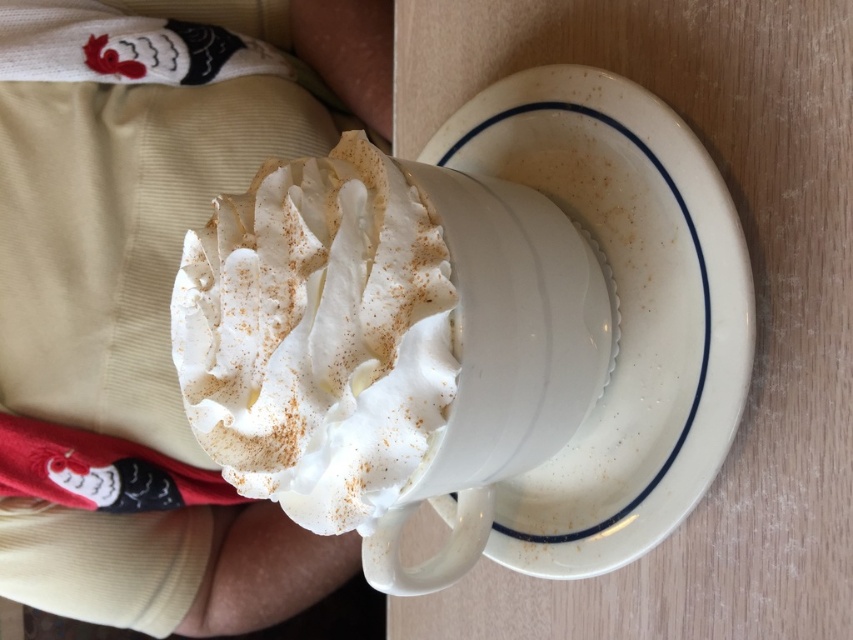
You are trying to place the white ceramic saucer at center on top of the white cotton socks at lower left. Will the saucer fit entirely on the socks without hanging off the edges?

The white cotton socks at lower left are wider than the white ceramic saucer at center, so the saucer will fit entirely on the socks without hanging off the edges.

You are looking at the cup and saucer on the table. There are two points marked on the image, point A at coordinates point (639,209) and point B at coordinates point (326,310). Which point is closer to you?

Point A at coordinates point (639,209) is closer to you because it is further to the viewer than point B at coordinates point (326,310).

In the scene shown: Please provide the 2D coordinates of the white ceramic saucer at center in the image. The coordinates should be in the format of a point with two decimal places, like point 0.5,0.5.

The white ceramic saucer at center is located at point [622,310].